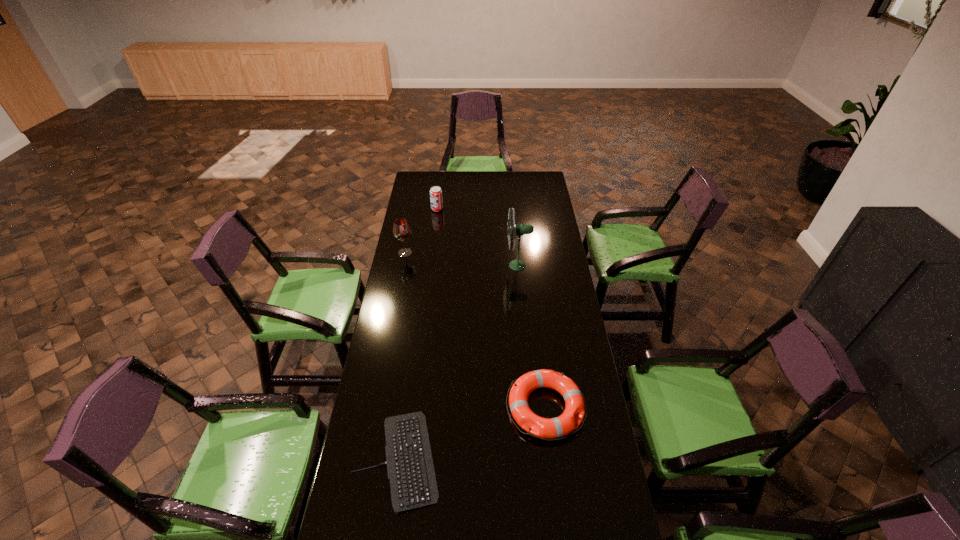
Image resolution: width=960 pixels, height=540 pixels. I want to click on free space located on the back of the soda can, so click(x=442, y=177).

At what (x,y) coordinates should I click in order to perform the action: click on free space located on the left of the life buoy. Please return your answer as a coordinate pair (x, y). This screenshot has width=960, height=540. Looking at the image, I should click on (468, 408).

The image size is (960, 540). I want to click on blank space located on the back of the shortest object, so click(x=410, y=371).

Identify the location of wineglass positioned at the left edge. (401, 230).

Where is `soda can situated at the left edge`? soda can situated at the left edge is located at coordinates (436, 200).

Image resolution: width=960 pixels, height=540 pixels. Identify the location of computer keyboard at the left edge. (410, 468).

Where is `object present at the right edge`? The width and height of the screenshot is (960, 540). object present at the right edge is located at coordinates (544, 428).

This screenshot has height=540, width=960. In order to click on free space at the far edge of the desktop in this screenshot , I will do `click(439, 183)`.

Find the location of a particular element. The image size is (960, 540). free point at the left edge is located at coordinates (407, 204).

Locate an element on the screen. vacant position at the right edge of the desktop is located at coordinates (567, 332).